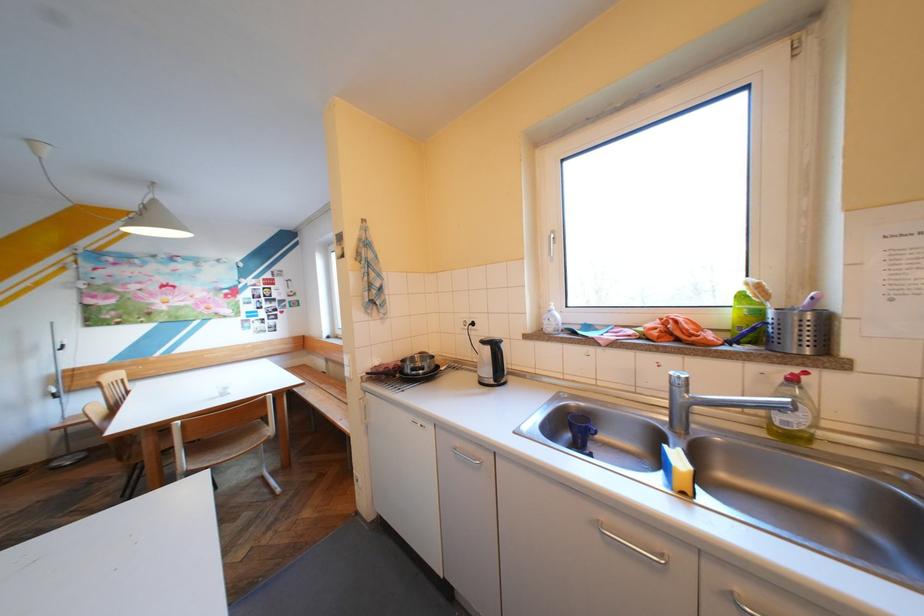
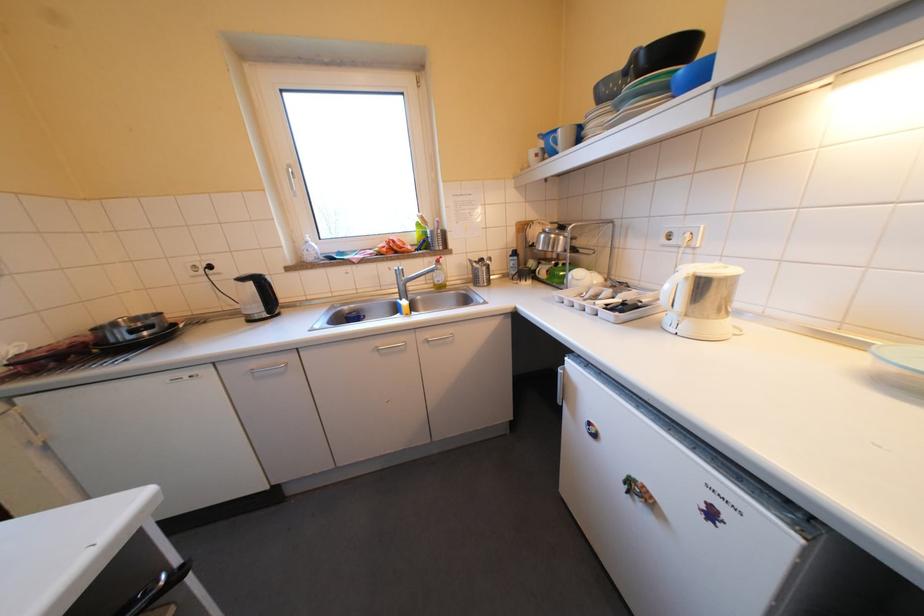
The point at (x=501, y=347) is marked in the first image. Where is the corresponding point in the second image?

(263, 284)